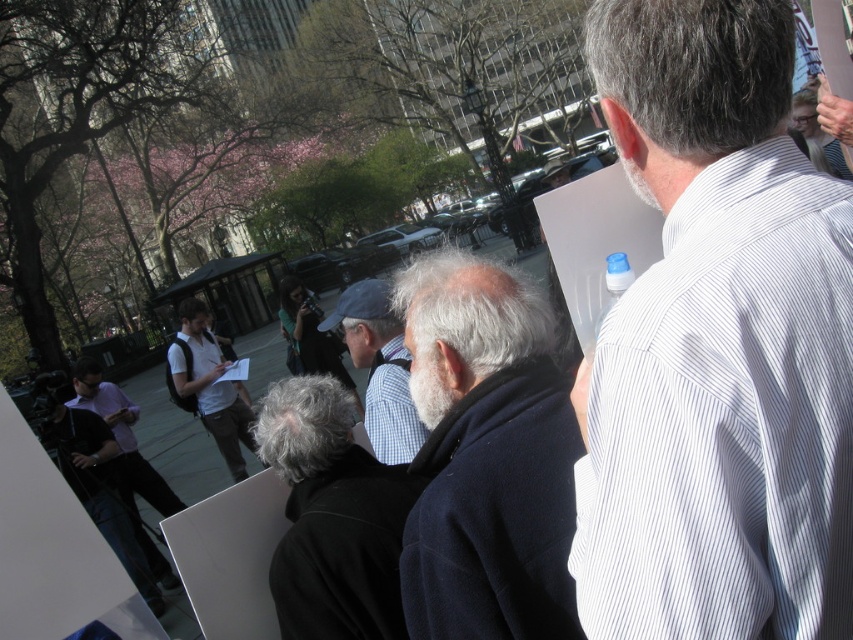
Is white striped shirt at upper right shorter than matte black shirt at lower left?

Yes, white striped shirt at upper right is shorter than matte black shirt at lower left.

Does white striped shirt at upper right come in front of matte black shirt at lower left?

Yes, white striped shirt at upper right is in front of matte black shirt at lower left.

Who is more forward, (743,378) or (90,408)?

Point (743,378) is more forward.

The image size is (853, 640). Identify the location of white striped shirt at upper right. (717, 346).

Is white striped shirt at upper right bigger than dark gray wool coat at center?

Indeed, white striped shirt at upper right has a larger size compared to dark gray wool coat at center.

Is point (717, 502) positioned in front of point (318, 538)?

Yes, point (717, 502) is in front of point (318, 538).

What are the coordinates of `white striped shirt at upper right` in the screenshot? It's located at (717, 346).

Can you confirm if dark blue wool coat at center is taller than gray woolen sweater at center?

Yes, dark blue wool coat at center is taller than gray woolen sweater at center.

Does dark blue wool coat at center appear under gray woolen sweater at center?

Correct, dark blue wool coat at center is located below gray woolen sweater at center.

Does point (444, 554) lie behind point (378, 310)?

No.

Locate an element on the screen. The image size is (853, 640). dark blue wool coat at center is located at coordinates (486, 456).